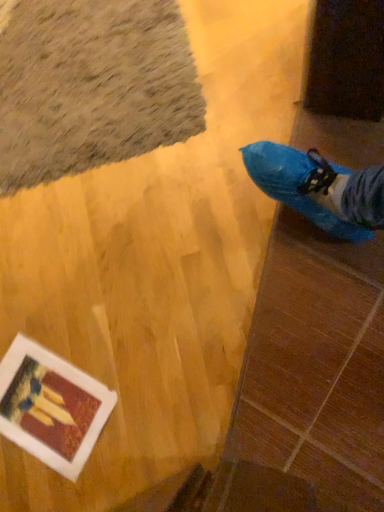
Question: Should I look upward or downward to see white matte painting at lower left?

Choices:
 (A) down
 (B) up

Answer: (A)